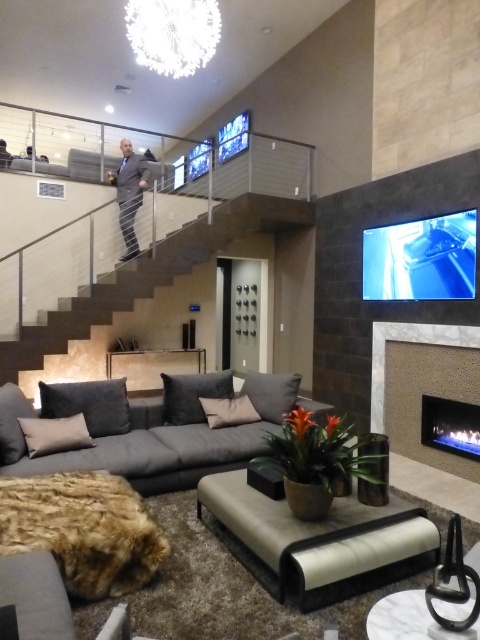
Is matte gray ottoman at center to the left of matte beige fireplace at lower right from the viewer's perspective?

Indeed, matte gray ottoman at center is positioned on the left side of matte beige fireplace at lower right.

The image size is (480, 640). In order to click on matte gray ottoman at center in this screenshot , I will do `click(316, 541)`.

Is dark gray stone stairs at center to the right of dark gray suit at upper center from the viewer's perspective?

Indeed, dark gray stone stairs at center is positioned on the right side of dark gray suit at upper center.

Who is lower down, dark gray stone stairs at center or dark gray suit at upper center?

dark gray stone stairs at center

Is point (121, 296) farther from viewer compared to point (128, 220)?

That is False.

Identify the location of dark gray stone stairs at center. The width and height of the screenshot is (480, 640). (120, 291).

Is point (352, 508) farther from camera compared to point (130, 216)?

No, (352, 508) is closer to viewer.

Which is more to the left, matte gray ottoman at center or dark gray suit at upper center?

dark gray suit at upper center is more to the left.

Does point (323, 576) lie in front of point (132, 230)?

Yes, it is.

Image resolution: width=480 pixels, height=640 pixels. Find the location of `matte gray ottoman at center`. matte gray ottoman at center is located at coordinates (316, 541).